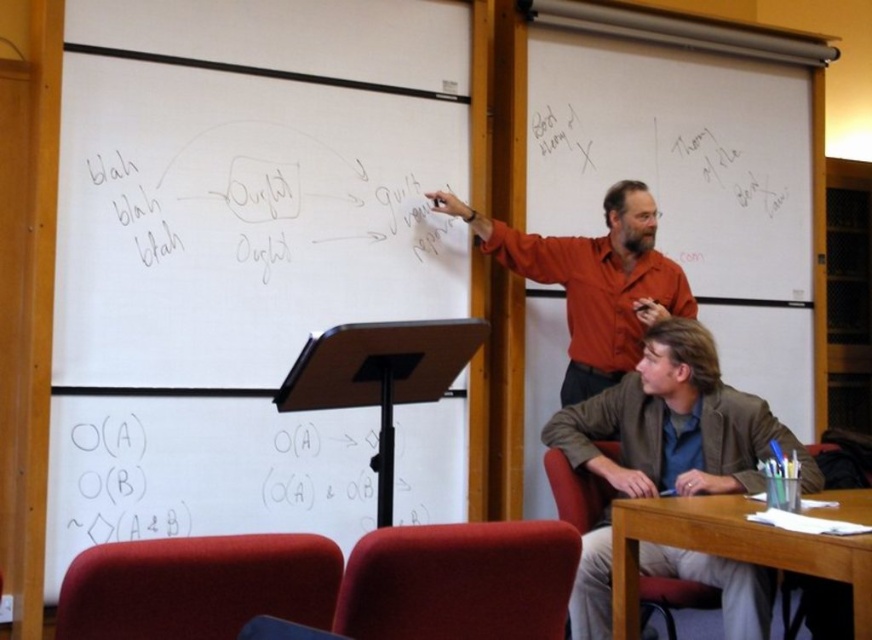
Question: Which of the following is the farthest from the observer?

Choices:
 (A) brown leather jacket at lower right
 (B) matte orange shirt at center
 (C) wooden table at lower right

Answer: (B)

Question: Which object is farther from the camera taking this photo?

Choices:
 (A) brown leather jacket at lower right
 (B) wooden table at lower right

Answer: (A)

Question: From the image, what is the correct spatial relationship of matte orange shirt at center in relation to wooden table at lower right?

Choices:
 (A) above
 (B) below

Answer: (A)

Question: Does brown leather jacket at lower right appear over wooden table at lower right?

Choices:
 (A) yes
 (B) no

Answer: (A)

Question: Estimate the real-world distances between objects in this image. Which object is closer to the wooden table at lower right?

Choices:
 (A) brown leather jacket at lower right
 (B) matte orange shirt at center

Answer: (A)

Question: Does brown leather jacket at lower right come behind matte orange shirt at center?

Choices:
 (A) no
 (B) yes

Answer: (A)